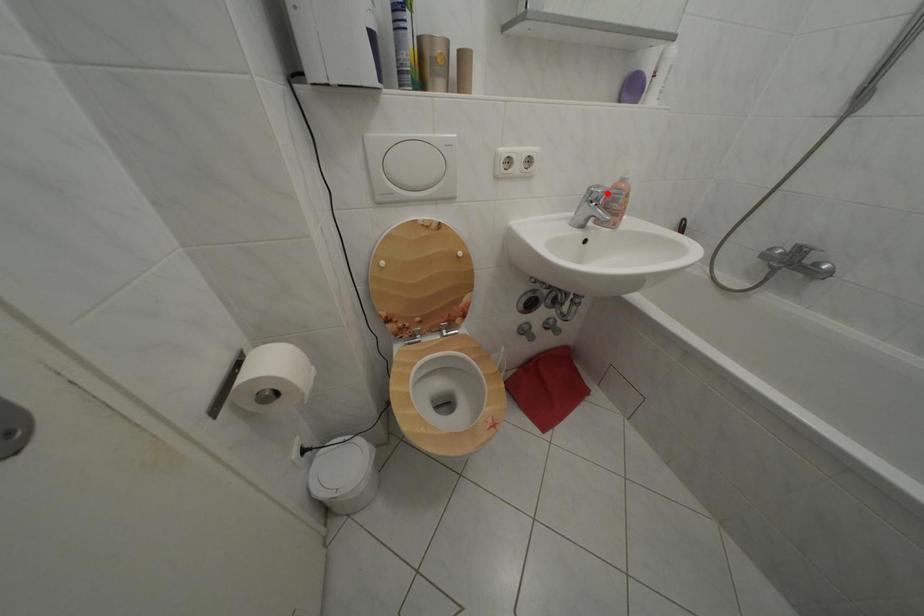
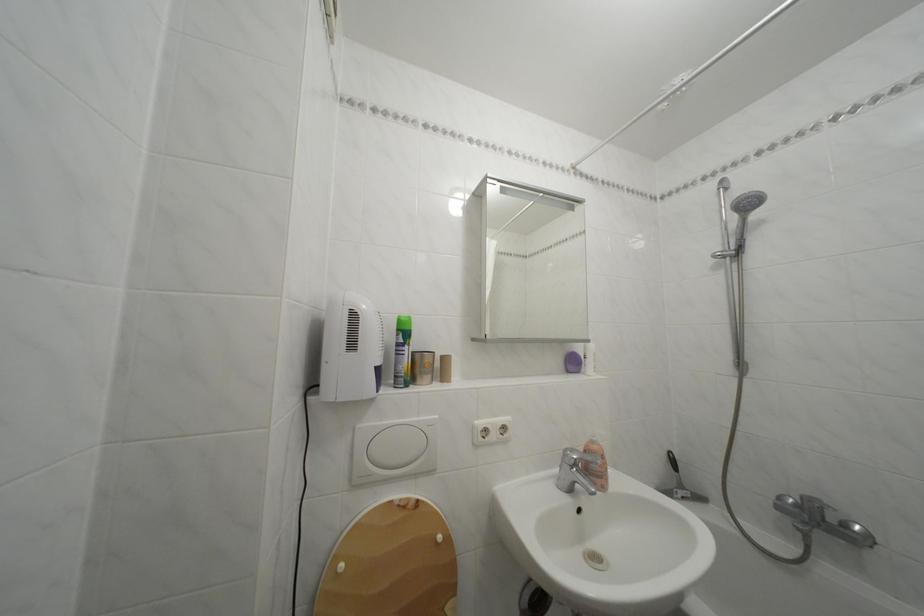
The point at the highlighted location is marked in the first image. Where is the corresponding point in the second image?

(581, 456)